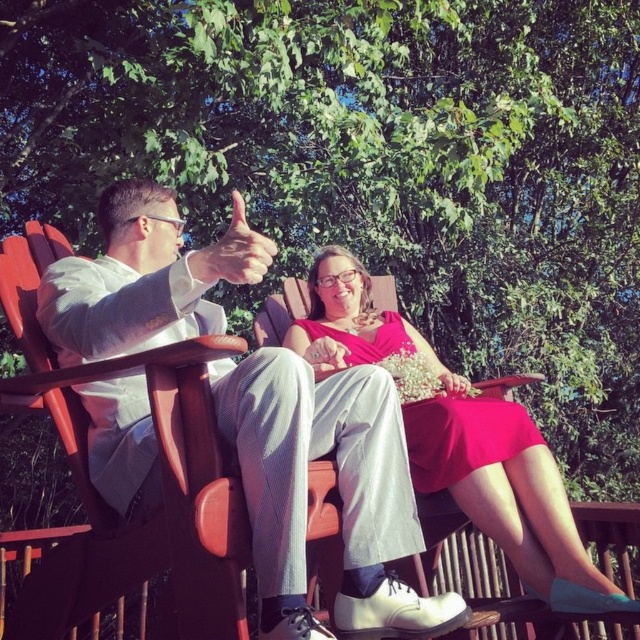
You are a photographer standing in front of the two people in the image. You want to take a photo that focuses on the light gray suit at center and the matte pink dress at center. Which of the two items should you adjust your focus on first to ensure both are in clear view?

The light gray suit at center is closer to the viewer than the matte pink dress at center, so you should focus on the light gray suit at center first to ensure both are in clear view.

You are a photographer setting up for a group photo. You have two subjects wearing the light gray suit at center and the matte pink dress at center. Based on their sizes, which clothing item would you position closer to the camera to ensure both appear balanced in the photo?

The light gray suit at center is smaller than the matte pink dress at center, so positioning the light gray suit at center closer to the camera would help balance their sizes in the photo.

You are a photographer setting up for a group photo. You have two subjects wearing the light gray suit at center and the matte pink dress at center. The minimum distance required between subjects for your camera lens to focus properly is 24 inches. Can both subjects be in focus if they are positioned exactly as shown in the image?

The light gray suit at center is 24.12 inches from the matte pink dress at center. Since the required minimum distance is 24 inches, the subjects are just barely within the focus range, so they can be in focus.